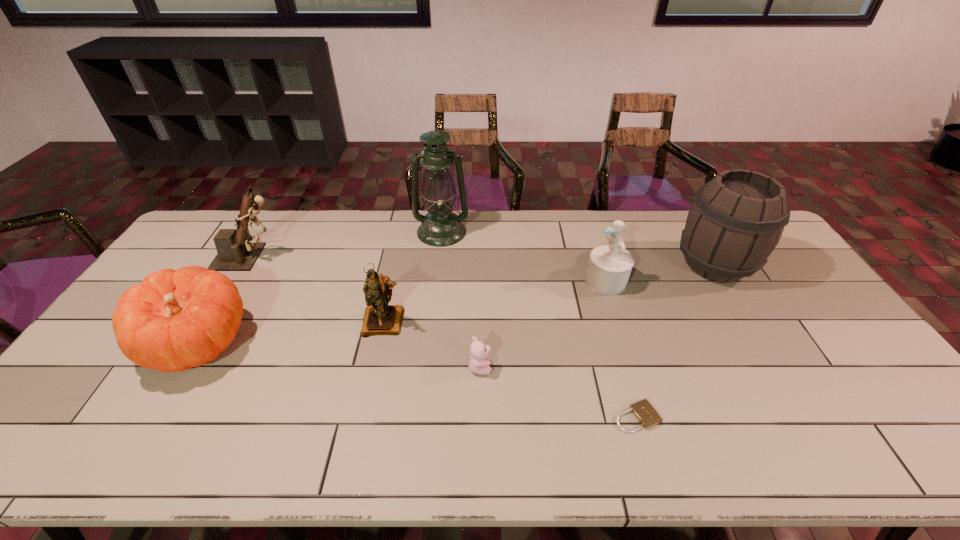
Find the location of a particular element. The image size is (960, 540). blank space located 0.190m on the left of the oil lamp is located at coordinates (362, 232).

I want to click on vacant area situated 0.380m on the left of the wine bucket, so click(561, 265).

At what (x,y) coordinates should I click in order to perform the action: click on free point located on the front-facing side of the tallest figurine. Please return your answer as a coordinate pair (x, y). Looking at the image, I should click on (300, 257).

You are a GUI agent. You are given a task and a screenshot of the screen. Output one action in this format:
    pyautogui.click(x=<x>, y=<y>)
    Task: Click on the vacant space situated at the beak of the rightmost figurine
    
    Given the screenshot: What is the action you would take?
    pyautogui.click(x=566, y=281)

Find the location of a particular element. vacant point located at the beak of the rightmost figurine is located at coordinates (500, 281).

Where is `vacant space located at the beak of the rightmost figurine`? This screenshot has height=540, width=960. vacant space located at the beak of the rightmost figurine is located at coordinates tap(569, 281).

Where is `free space located 0.200m on the front-facing side of the second figurine from left to right`? free space located 0.200m on the front-facing side of the second figurine from left to right is located at coordinates (368, 400).

This screenshot has height=540, width=960. Identify the location of vacant space situated on the back of the pumpkin. (243, 268).

This screenshot has width=960, height=540. What are the coordinates of `vacant region located at the face of the fifth object from left to right` in the screenshot? It's located at (602, 367).

Locate an element on the screen. free location located 0.210m on the back of the shortest object is located at coordinates (613, 336).